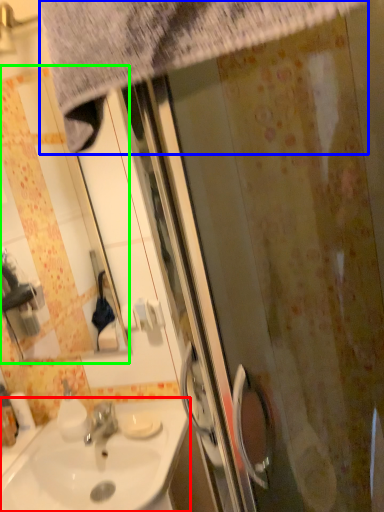
Question: Which object is the closest to the sink (highlighted by a red box)? Choose among these: shower curtain (highlighted by a blue box) or mirror (highlighted by a green box).

Choices:
 (A) shower curtain
 (B) mirror

Answer: (A)